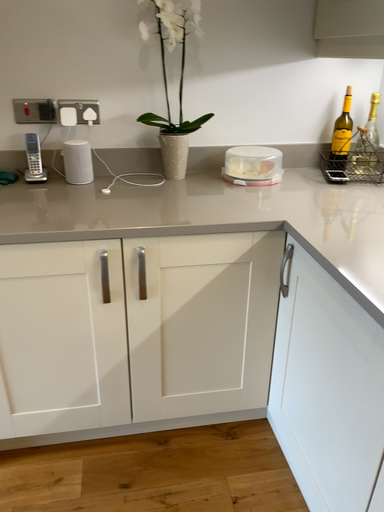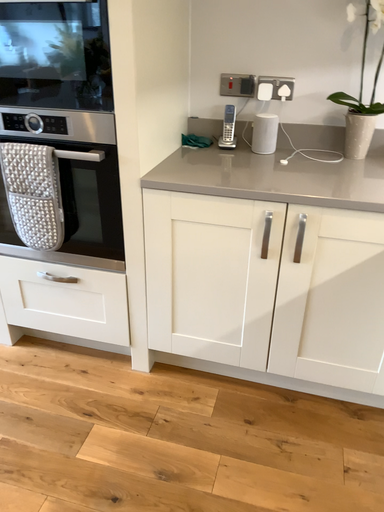
Question: How did the camera likely rotate when shooting the video?

Choices:
 (A) rotated left
 (B) rotated right

Answer: (A)